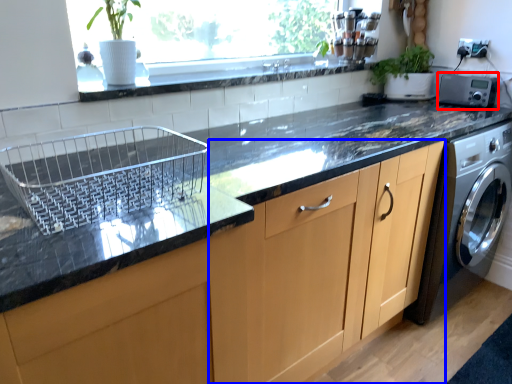
Question: Which point is closer to the camera, appliance (highlighted by a red box) or cabinetry (highlighted by a blue box)?

Choices:
 (A) appliance
 (B) cabinetry

Answer: (B)